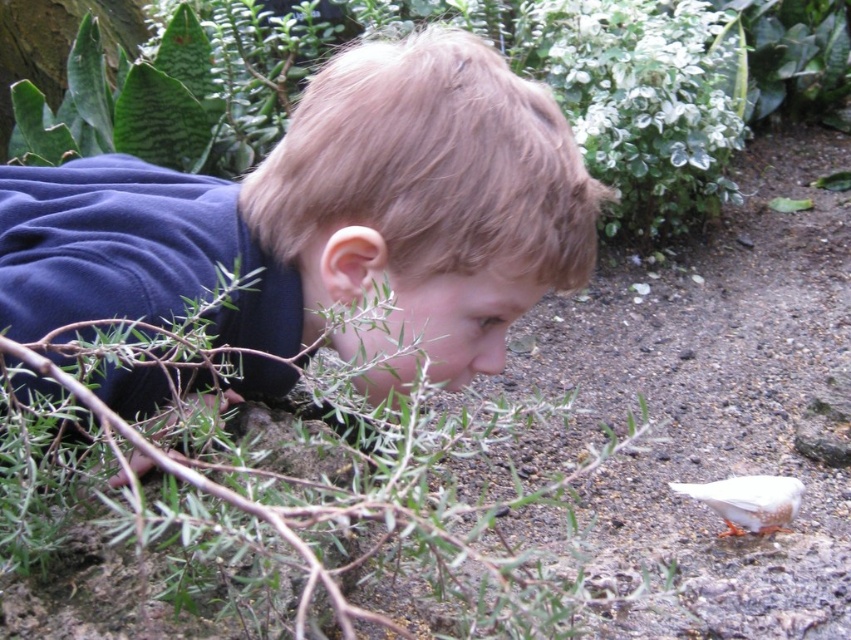
You are standing at the position of the child in the image. There are two points marked in the scene. The first point is at coordinates point (443, 566) and the second is at point (760, 497). Which point is closer to you?

Point (443, 566) is in front of point (760, 497), so it is closer to you.

You are a photographer trying to capture the white speckled feather at lower right without the green leafy plant at center blocking it. What adjustment should you make to your camera angle?

The green leafy plant at center is positioned over the white speckled feather at lower right, so you should lower your camera angle to avoid the plant blocking the feather.

You are a photographer trying to capture the child in the image. The child is wearing a dark blue sweatshirt at center. To ensure the focus is on the child, where should you adjust your camera focus? Please provide coordinates in the format of a point like this example format, e.g., point 0.336, 0.387.

The dark blue sweatshirt at center is located at point (328, 214), so you should adjust your camera focus to point (328, 214) to ensure the child is in focus.